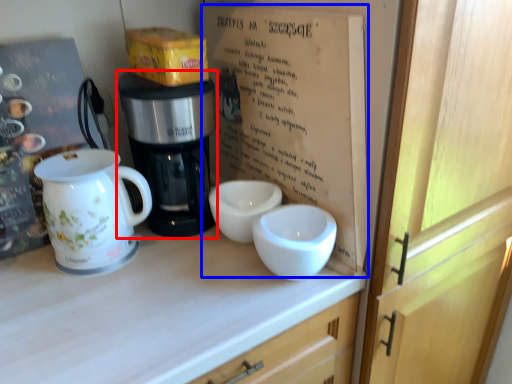
Question: Which object appears farthest to the camera in this image, coffee maker (highlighted by a red box) or book (highlighted by a blue box)?

Choices:
 (A) coffee maker
 (B) book

Answer: (A)